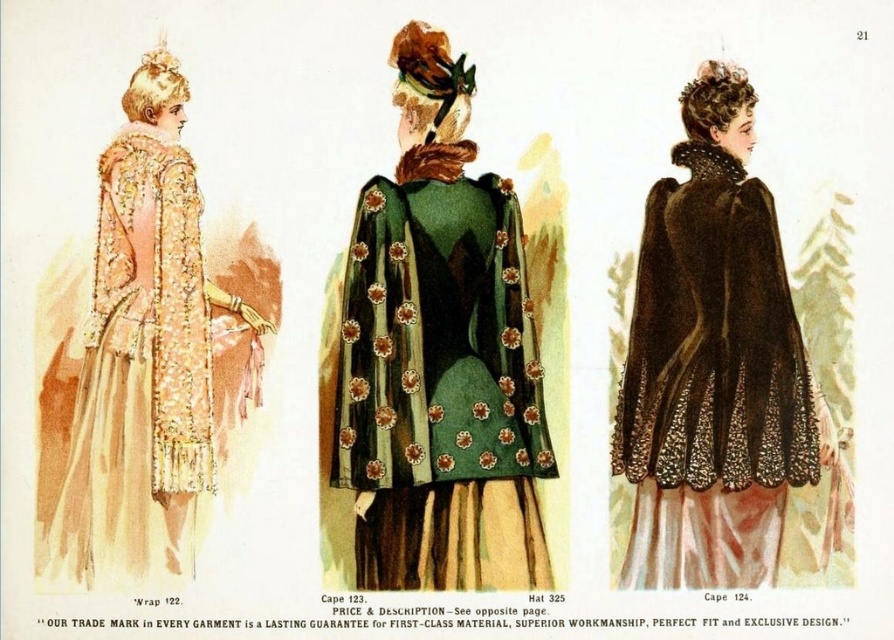
You are a fashion historian examining the vintage illustration of three women. You notice two capes in the image. The velvet cape at center and the matte gold cape at left. Which cape is closer to the viewer?

The matte gold cape at left is closer to the viewer because the velvet cape at center is positioned under it.

You are an assistant at a historical fashion exhibit. You notice the green velvet cape at center and the matte gold cape at left in the illustration. Which cape is positioned lower in the image?

The green velvet cape at center is positioned lower than the matte gold cape at left, as it is described to be below it.